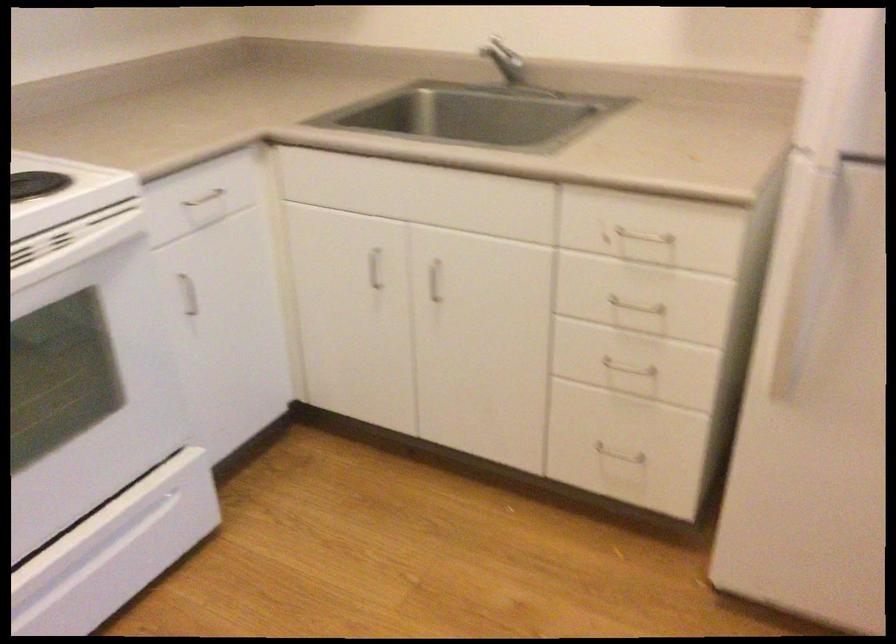
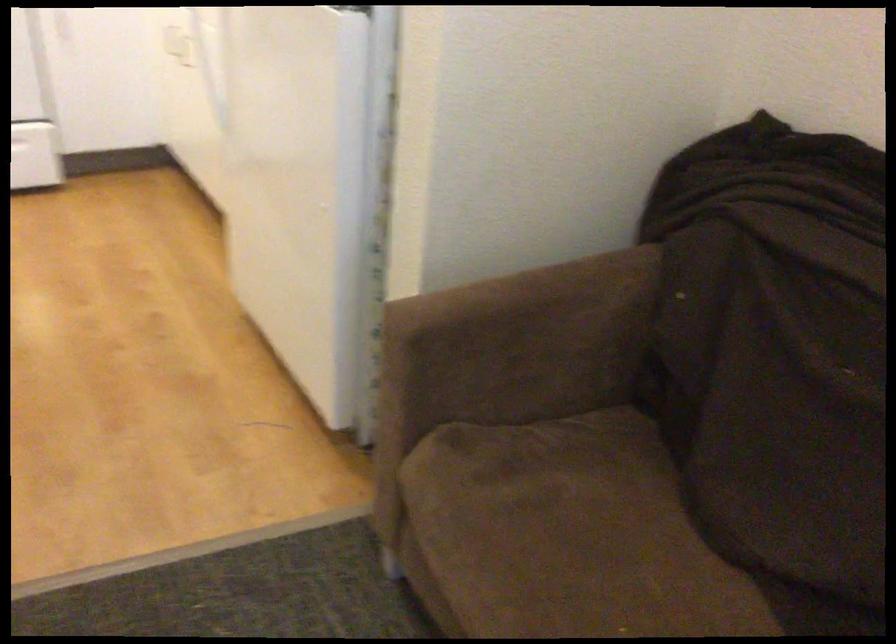
Question: I am providing you with two images of the same scene from different viewpoints. After the viewpoint changes to image2, which objects are now occluded?

Choices:
 (A) brown sofa armrest
 (B) pen holder cup
 (C) sofa sitting surface
 (D) metal pull handle

Answer: (D)